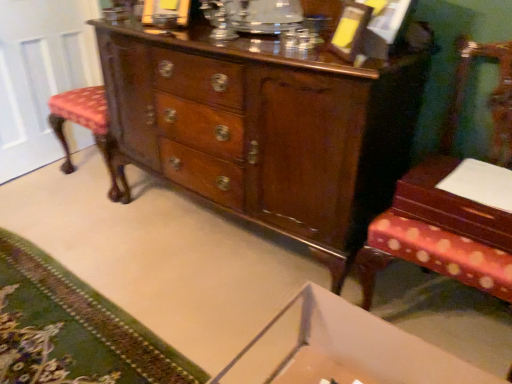
Image resolution: width=512 pixels, height=384 pixels. What are the coordinates of `vacant region in front of white glossy door at left` in the screenshot? It's located at (49, 196).